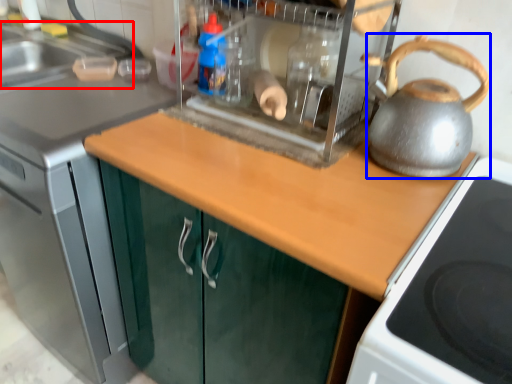
Question: Which point is further to the camera, sink (highlighted by a red box) or kettle (highlighted by a blue box)?

Choices:
 (A) sink
 (B) kettle

Answer: (A)